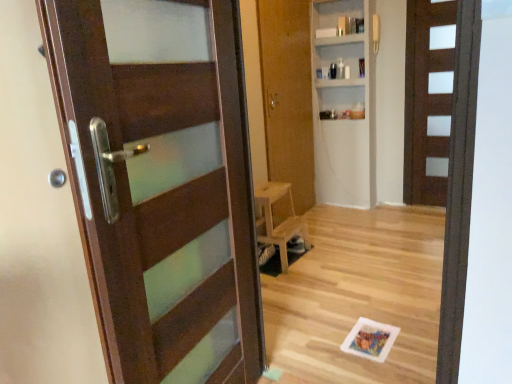
Question: Does white matte bookshelf at upper center have a greater height compared to matte brown door at left, acting as the 1th door starting from the front?

Choices:
 (A) yes
 (B) no

Answer: (A)

Question: Is white matte bookshelf at upper center surrounding matte brown door at left, positioned as the third door in right-to-left order?

Choices:
 (A) no
 (B) yes

Answer: (A)

Question: Is white matte bookshelf at upper center shorter than matte brown door at left, acting as the 1th door starting from the front?

Choices:
 (A) yes
 (B) no

Answer: (B)

Question: Is matte brown door at left, positioned as the 3th door in back-to-front order, at the back of white matte bookshelf at upper center?

Choices:
 (A) no
 (B) yes

Answer: (A)

Question: From the image's perspective, does white matte bookshelf at upper center appear lower than matte brown door at left, positioned as the third door in right-to-left order?

Choices:
 (A) no
 (B) yes

Answer: (A)

Question: Is white matte bookshelf at upper center thinner than matte brown door at left, positioned as the 1th door in left-to-right order?

Choices:
 (A) no
 (B) yes

Answer: (B)

Question: Is wooden chair at center to the left of brown matte door at right, the first door in the back-to-front sequence, from the viewer's perspective?

Choices:
 (A) yes
 (B) no

Answer: (A)

Question: From a real-world perspective, is wooden chair at center physically below brown matte door at right, arranged as the third door when viewed from the front?

Choices:
 (A) yes
 (B) no

Answer: (A)

Question: From the image's perspective, is wooden chair at center beneath brown matte door at right, positioned as the 3th door in left-to-right order?

Choices:
 (A) yes
 (B) no

Answer: (A)

Question: Is wooden chair at center oriented towards brown matte door at right, positioned as the 3th door in left-to-right order?

Choices:
 (A) yes
 (B) no

Answer: (B)

Question: Is wooden chair at center positioned in front of brown matte door at right, arranged as the third door when viewed from the front?

Choices:
 (A) no
 (B) yes

Answer: (B)

Question: Considering the relative sizes of wooden chair at center and brown matte door at right, positioned as the 3th door in left-to-right order, in the image provided, is wooden chair at center taller than brown matte door at right, positioned as the 3th door in left-to-right order,?

Choices:
 (A) yes
 (B) no

Answer: (B)

Question: Can you confirm if matte brown door at left, positioned as the 3th door in back-to-front order, is shorter than brown matte door at right, the first door in the back-to-front sequence?

Choices:
 (A) yes
 (B) no

Answer: (A)